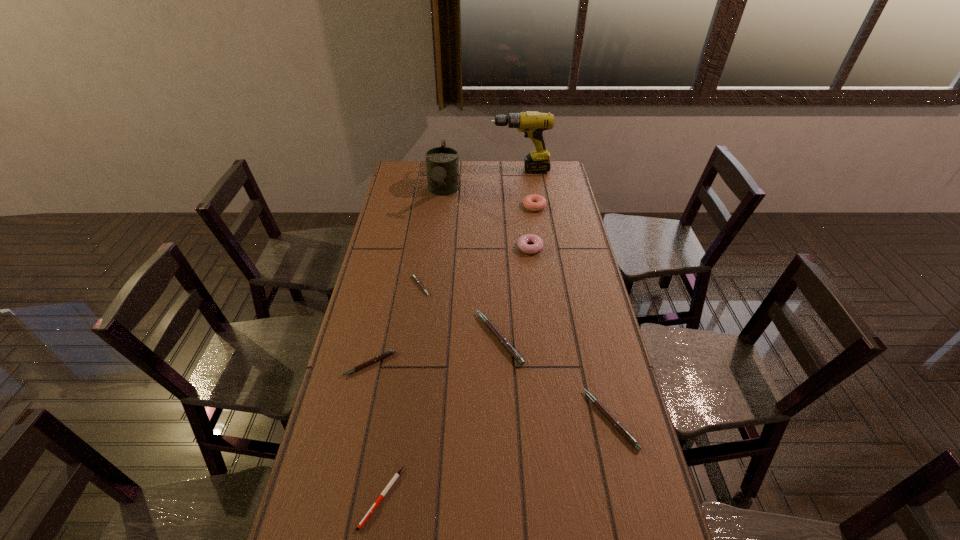
Find the location of a particular element. The image size is (960, 540). the tallest object is located at coordinates (532, 123).

Identify the location of the eighth shortest object. This screenshot has height=540, width=960. (442, 163).

Locate an element on the screen. watering can is located at coordinates (442, 163).

Where is `purple doughnut`? This screenshot has width=960, height=540. purple doughnut is located at coordinates (537, 245).

Find the location of a particular element. the sixth nearest object is located at coordinates (537, 245).

Where is `the farther doughnut`? the farther doughnut is located at coordinates (533, 202).

At what (x,y) coordinates should I click in order to perform the action: click on the biggest pink pen. Please return your answer as a coordinate pair (x, y). This screenshot has width=960, height=540. Looking at the image, I should click on pyautogui.click(x=513, y=352).

Locate an element on the screen. Image resolution: width=960 pixels, height=540 pixels. the second pink pen from right to left is located at coordinates (513, 352).

The width and height of the screenshot is (960, 540). Identify the location of the rightmost pen. 602,409.

Identify the location of the second nearest pen. The width and height of the screenshot is (960, 540). tap(602, 409).